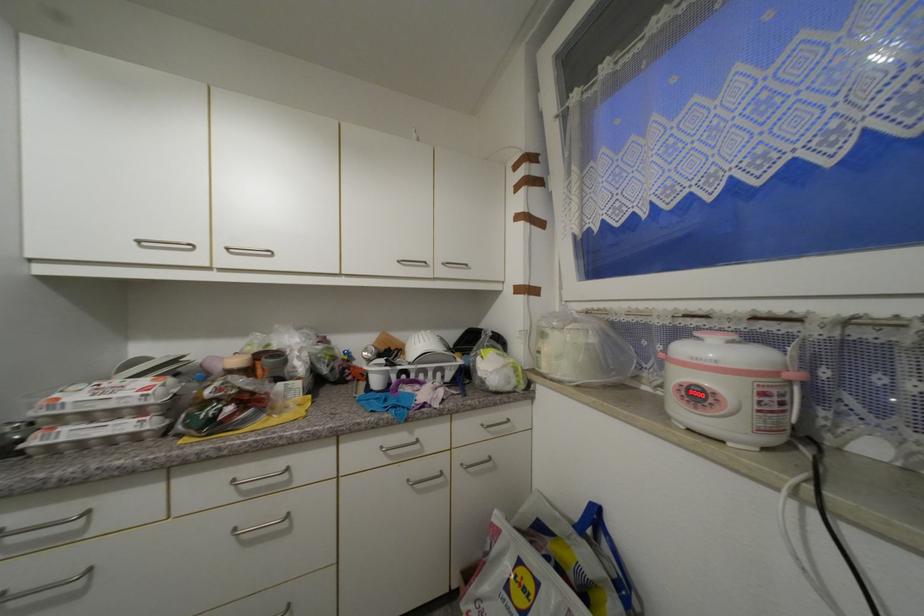
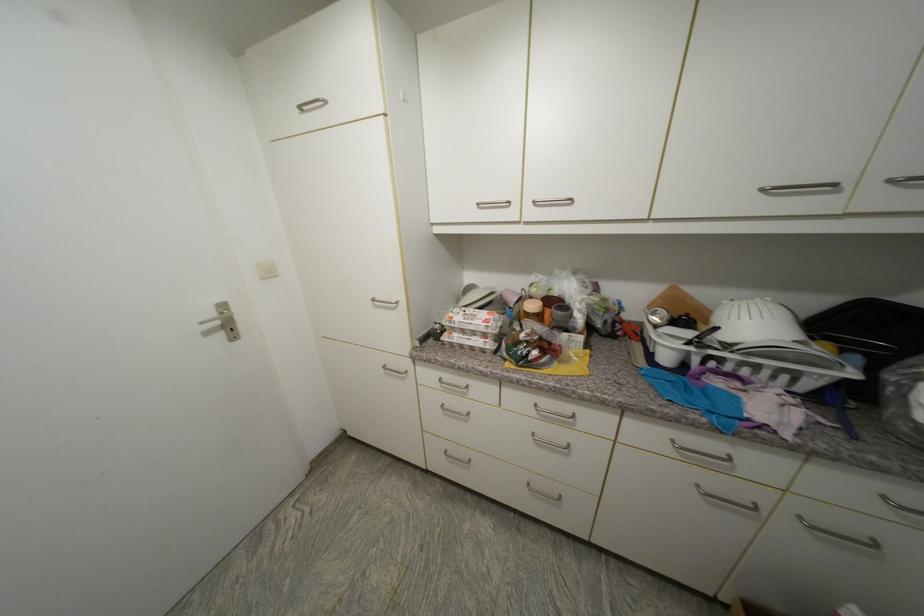
Locate, in the second image, the point that corresponds to (x=144, y=244) in the first image.

(483, 206)